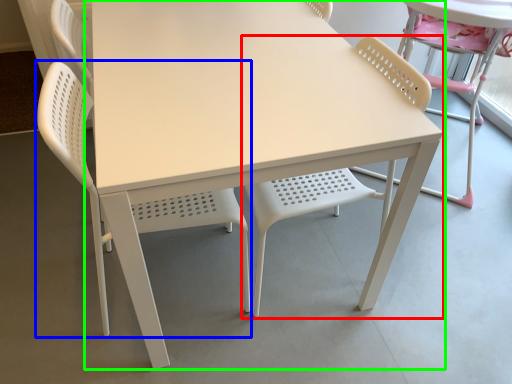
Question: Estimate the real-world distances between objects in this image. Which object is closer to chair (highlighted by a red box), chair (highlighted by a blue box) or table (highlighted by a green box)?

Choices:
 (A) chair
 (B) table

Answer: (A)